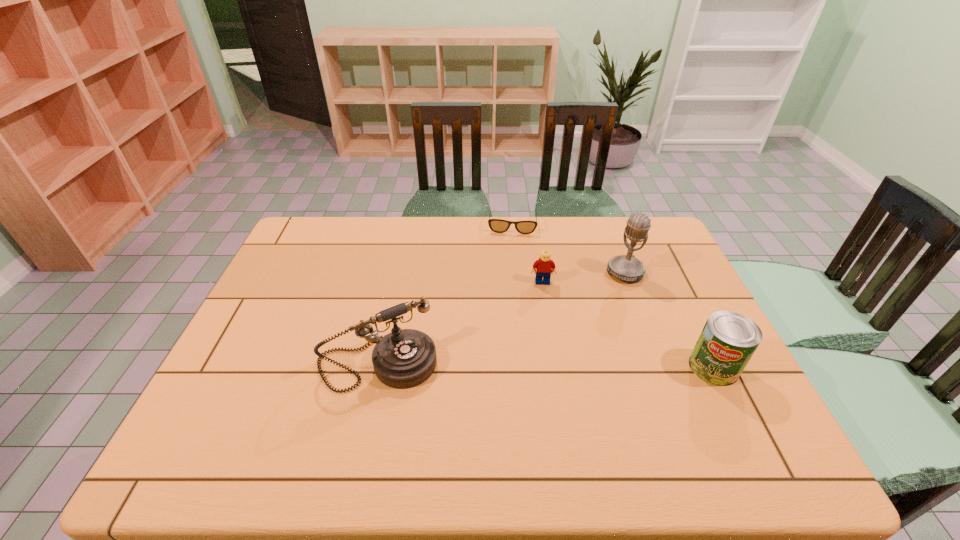
Where is `free spot that satisfies the following two spatial constraints: 1. on the front side of the farthest object; 2. on the right side of the microphone`? This screenshot has height=540, width=960. free spot that satisfies the following two spatial constraints: 1. on the front side of the farthest object; 2. on the right side of the microphone is located at coordinates (516, 273).

Identify the location of vacant space that satisfies the following two spatial constraints: 1. on the front side of the second object from right to left; 2. on the left side of the rightmost object. (661, 367).

Find the location of a particular element. Image resolution: width=960 pixels, height=540 pixels. free space that satisfies the following two spatial constraints: 1. on the back side of the tallest object; 2. on the right side of the telephone is located at coordinates (396, 273).

Locate an element on the screen. vacant point that satisfies the following two spatial constraints: 1. on the front side of the farthest object; 2. on the right side of the can is located at coordinates (526, 367).